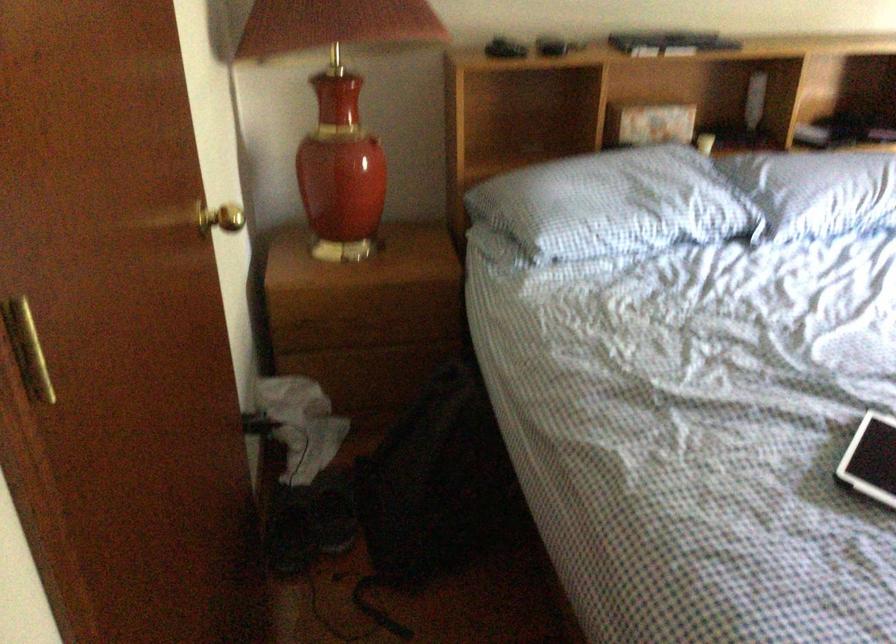
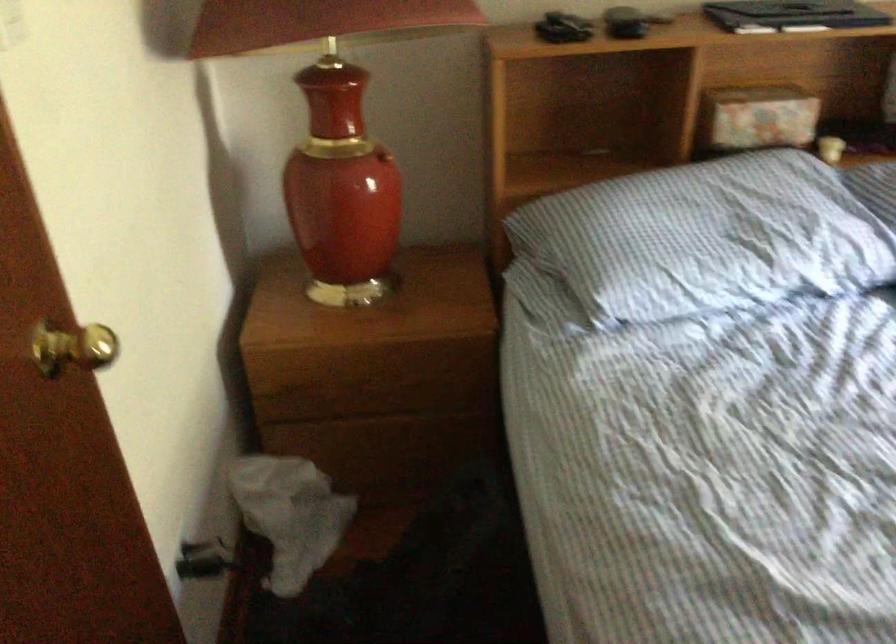
Locate, in the second image, the point that corresponds to (x=303, y=422) in the first image.

(289, 515)